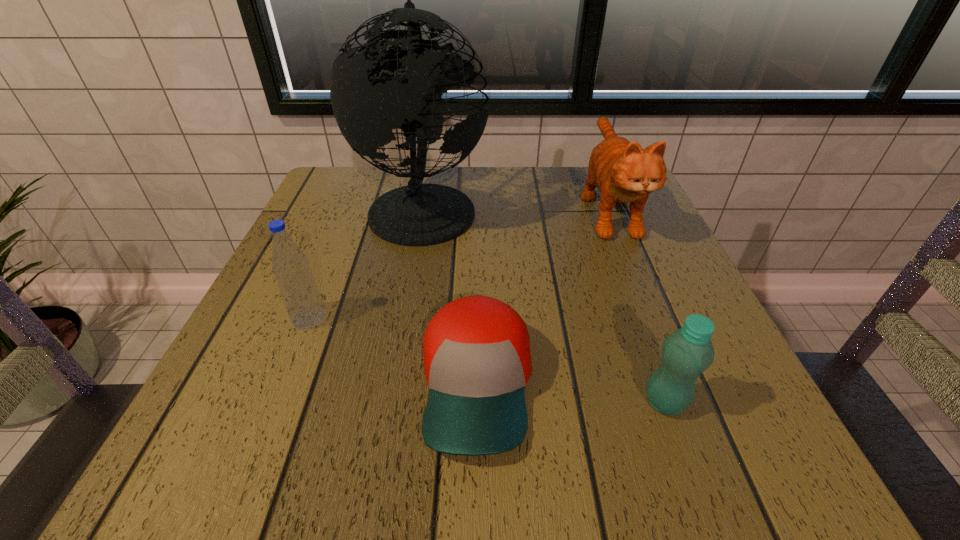
Where is `object that can be found as the closest to the baseball cap`? The image size is (960, 540). object that can be found as the closest to the baseball cap is located at coordinates pyautogui.click(x=685, y=354).

Image resolution: width=960 pixels, height=540 pixels. In order to click on free space that satisfies the following two spatial constraints: 1. on the front-facing side of the globe; 2. on the front side of the farther water bottle in this screenshot , I will do `click(403, 318)`.

At what (x,y) coordinates should I click in order to perform the action: click on vacant space that satisfies the following two spatial constraints: 1. on the face of the cat; 2. at the front cap of the nearer water bottle. Please return your answer as a coordinate pair (x, y). This screenshot has width=960, height=540. Looking at the image, I should click on (687, 402).